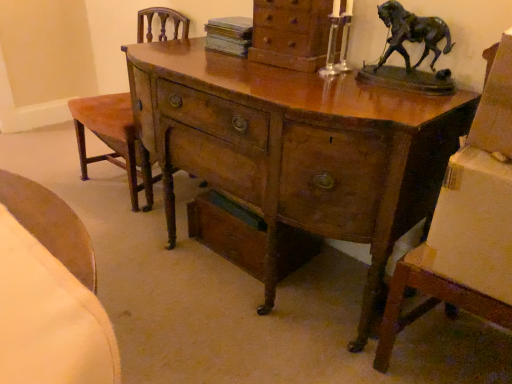
Question: Can you confirm if wooden desk at center is smaller than velvet orange armchair at left?

Choices:
 (A) no
 (B) yes

Answer: (A)

Question: Is wooden desk at center wider than velvet orange armchair at left?

Choices:
 (A) no
 (B) yes

Answer: (B)

Question: Can you confirm if wooden desk at center is shorter than velvet orange armchair at left?

Choices:
 (A) yes
 (B) no

Answer: (A)

Question: Is wooden desk at center to the left of velvet orange armchair at left from the viewer's perspective?

Choices:
 (A) no
 (B) yes

Answer: (A)

Question: Is wooden desk at center thinner than velvet orange armchair at left?

Choices:
 (A) yes
 (B) no

Answer: (B)

Question: In the image, is wooden chest of drawers at upper center positioned in front of or behind wooden drawer at lower center?

Choices:
 (A) front
 (B) behind

Answer: (A)

Question: From a real-world perspective, is wooden chest of drawers at upper center above or below wooden drawer at lower center?

Choices:
 (A) above
 (B) below

Answer: (A)

Question: Is point (318, 56) closer or farther from the camera than point (193, 203)?

Choices:
 (A) farther
 (B) closer

Answer: (B)

Question: Visually, is wooden chest of drawers at upper center positioned to the left or to the right of wooden drawer at lower center?

Choices:
 (A) right
 (B) left

Answer: (A)

Question: From the image's perspective, is wooden chest of drawers at upper center positioned above or below velvet orange armchair at left?

Choices:
 (A) below
 (B) above

Answer: (B)

Question: Is wooden chest of drawers at upper center to the left or to the right of velvet orange armchair at left in the image?

Choices:
 (A) left
 (B) right

Answer: (B)

Question: Is wooden chest of drawers at upper center situated inside velvet orange armchair at left or outside?

Choices:
 (A) outside
 (B) inside

Answer: (A)

Question: Relative to velvet orange armchair at left, is wooden chest of drawers at upper center in front or behind?

Choices:
 (A) front
 (B) behind

Answer: (A)

Question: Considering the positions of wooden drawer at lower center and wooden desk at center in the image, is wooden drawer at lower center wider or thinner than wooden desk at center?

Choices:
 (A) thin
 (B) wide

Answer: (A)

Question: Is wooden drawer at lower center spatially inside wooden desk at center, or outside of it?

Choices:
 (A) outside
 (B) inside

Answer: (B)